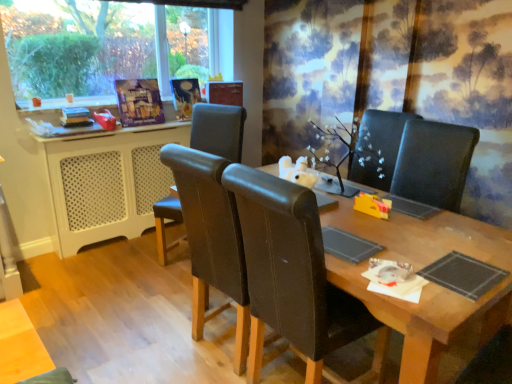
Question: From the image's perspective, is brown leather chair at center, positioned as the 1th chair in right-to-left order, located above or below white perforated plastic at left?

Choices:
 (A) above
 (B) below

Answer: (B)

Question: From a real-world perspective, is brown leather chair at center, which appears as the 2th chair when viewed from the left, positioned above or below white perforated plastic at left?

Choices:
 (A) above
 (B) below

Answer: (A)

Question: Which object is positioned farthest from the wooden table at center?

Choices:
 (A) brown leather chair at center, positioned as the first chair in front-to-back order
 (B) leather at center, arranged as the 2th chair when viewed from the right
 (C) white perforated plastic at left

Answer: (C)

Question: Estimate the real-world distances between objects in this image. Which object is farther from the leather at center, which is counted as the 2th chair, starting from the front?

Choices:
 (A) wooden table at center
 (B) white perforated plastic at left
 (C) brown leather chair at center, the 2th chair from the back

Answer: (A)